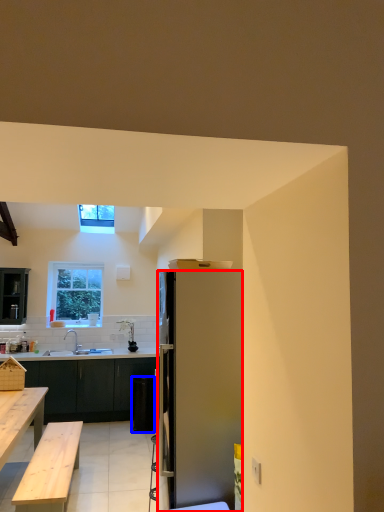
Question: Which object appears closest to the camera in this image, refrigerator (highlighted by a red box) or trash bin/can (highlighted by a blue box)?

Choices:
 (A) refrigerator
 (B) trash bin/can

Answer: (A)